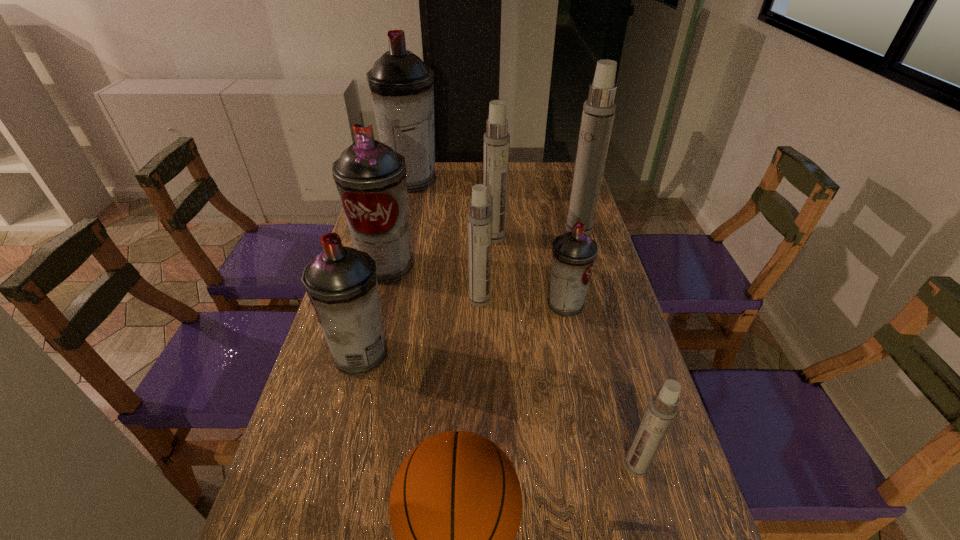
In order to click on the rightmost gray aerosol can in this screenshot , I will do `click(574, 253)`.

I want to click on the nearest white aerosol can, so click(x=662, y=409).

This screenshot has width=960, height=540. Identify the location of the nearest aerosol can. (662, 409).

Identify the location of vacant region located on the right of the farthest gray aerosol can. The width and height of the screenshot is (960, 540). (505, 180).

Image resolution: width=960 pixels, height=540 pixels. Find the location of `vacant space situated on the left of the biggest white aerosol can`. vacant space situated on the left of the biggest white aerosol can is located at coordinates (511, 230).

Find the location of a particular element. free location located on the back of the second farthest gray aerosol can is located at coordinates (399, 215).

I want to click on vacant space situated on the right of the second biggest white aerosol can, so click(536, 238).

The height and width of the screenshot is (540, 960). Identify the location of free region located 0.380m on the back of the third farthest white aerosol can. (480, 219).

This screenshot has width=960, height=540. Find the location of `vacant space situated 0.310m on the front of the second smallest gray aerosol can`. vacant space situated 0.310m on the front of the second smallest gray aerosol can is located at coordinates (319, 519).

I want to click on vacant region located on the back of the third farthest gray aerosol can, so click(x=558, y=269).